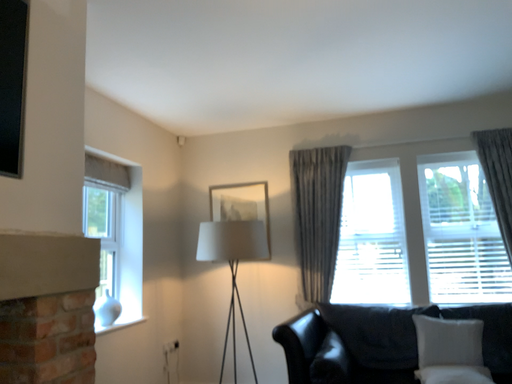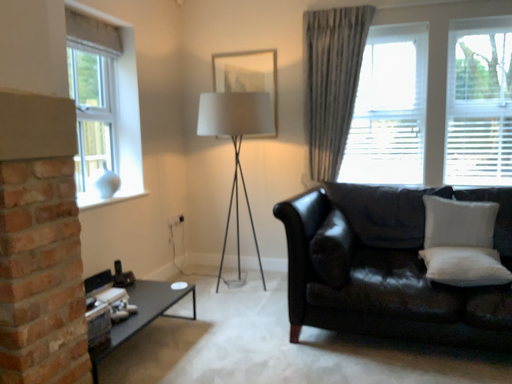
Question: Which way did the camera rotate in the video?

Choices:
 (A) rotated downward
 (B) rotated upward

Answer: (A)